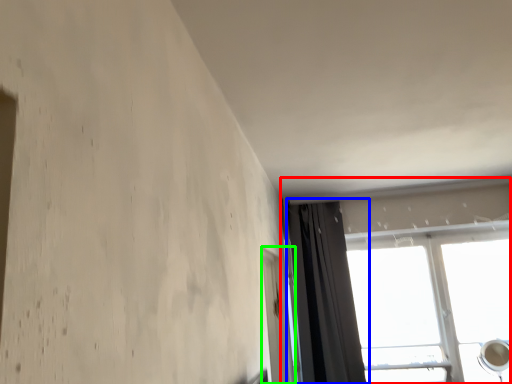
Question: Which object is positioned farthest from window (highlighted by a red box)? Select from curtain (highlighted by a blue box) and screen door (highlighted by a green box).

Choices:
 (A) curtain
 (B) screen door

Answer: (B)